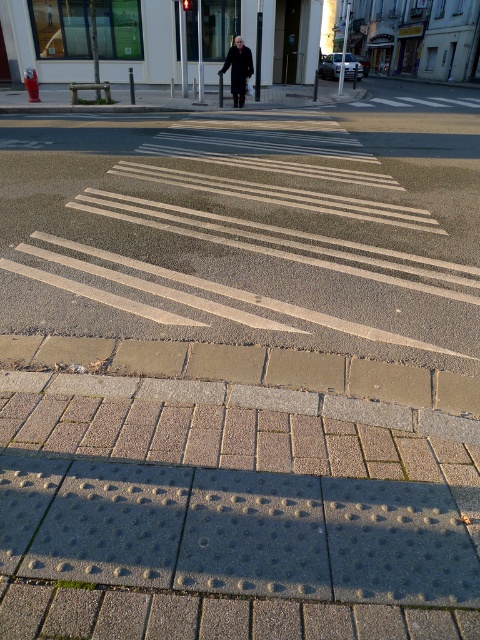
You are a visually impaired pedestrian using a cane. You feel the tactile paving transitioning into brick pavement as you approach the white painted lines at center and dark gray wool coat at center. Which object is higher in height?

The white painted lines at center are taller than the dark gray wool coat at center.

You are standing at the tactile paving strip and want to walk towards the person walking away from the camera. Which point, point (120,125) or point (228,60), is closer to your current position?

Point (120,125) is closer to your current position at the tactile paving strip because it is in front of point (228,60).

You are standing at the tactile paving strip and want to reach the brick textured pavement at lower center. According to the scene description, in which direction should you move relative to your current position?

You should move forward towards the brick textured pavement at lower center since it is located at point (231, 513), which is ahead of your current position at the tactile paving strip.